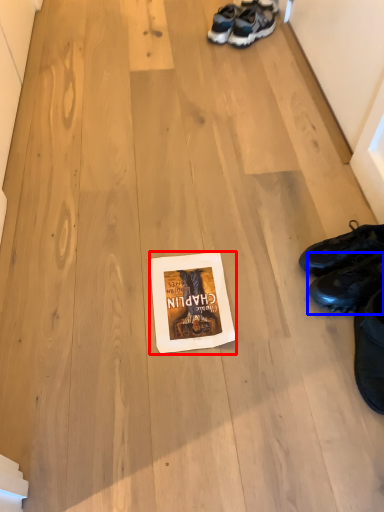
Question: Which point is further to the camera, paperback book (highlighted by a red box) or footwear (highlighted by a blue box)?

Choices:
 (A) paperback book
 (B) footwear

Answer: (A)